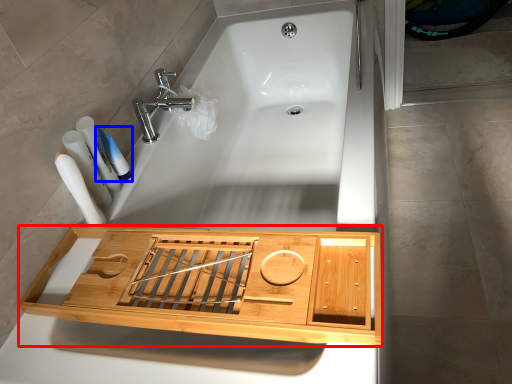
Question: Among these objects, which one is farthest to the camera, cabinetry (highlighted by a red box) or toothpaste (highlighted by a blue box)?

Choices:
 (A) cabinetry
 (B) toothpaste

Answer: (B)